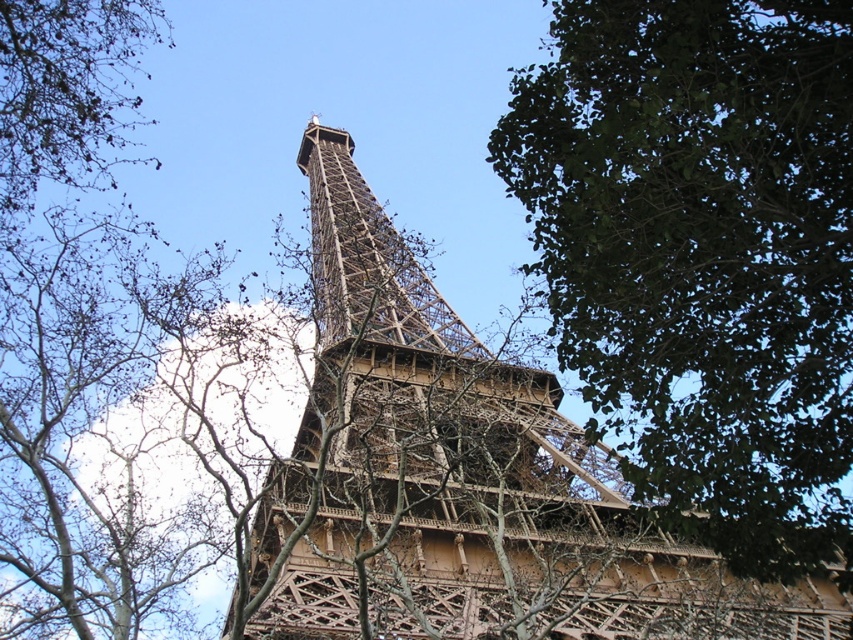
Does point (503, 160) lie behind point (463, 593)?

Yes, it is behind point (463, 593).

Measure the distance from green leafy tree at center to brown metal eiffel tower at center.

green leafy tree at center and brown metal eiffel tower at center are 75.71 feet apart.

The height and width of the screenshot is (640, 853). Describe the element at coordinates (701, 256) in the screenshot. I see `green leafy tree at center` at that location.

At what (x,y) coordinates should I click in order to perform the action: click on green leafy tree at center. Please return your answer as a coordinate pair (x, y). Image resolution: width=853 pixels, height=640 pixels. Looking at the image, I should click on (701, 256).